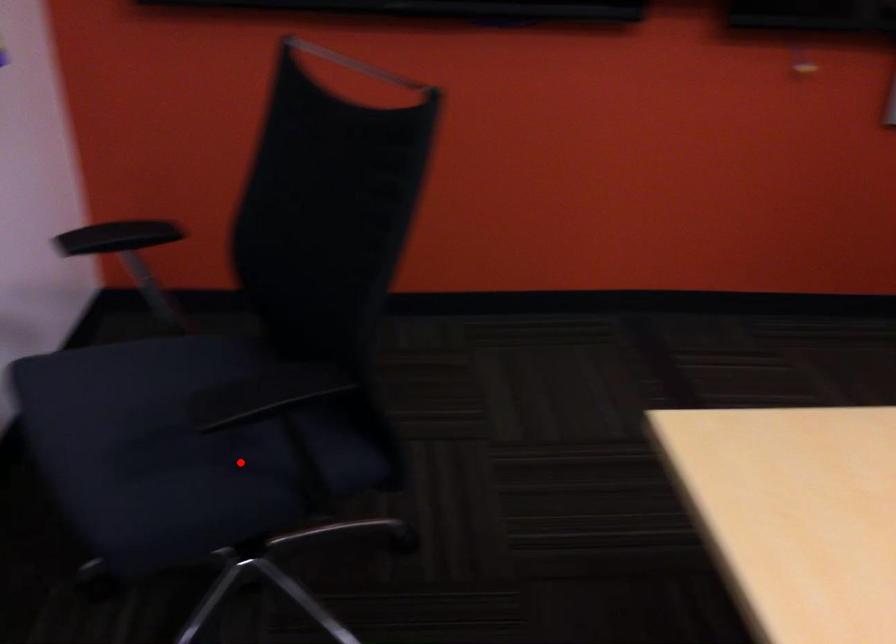
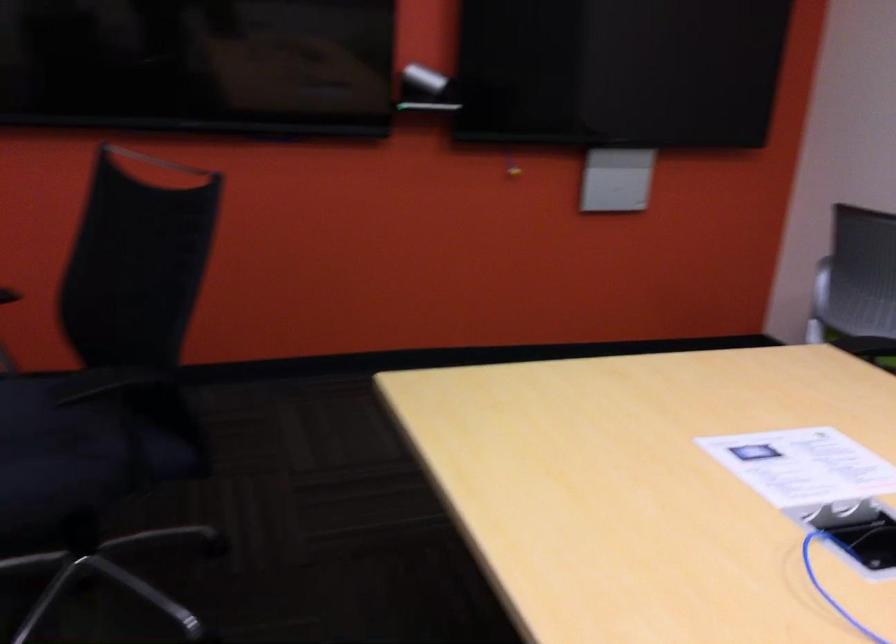
Where in the second image is the point corresponding to the highlighted location from the first image?

(82, 450)